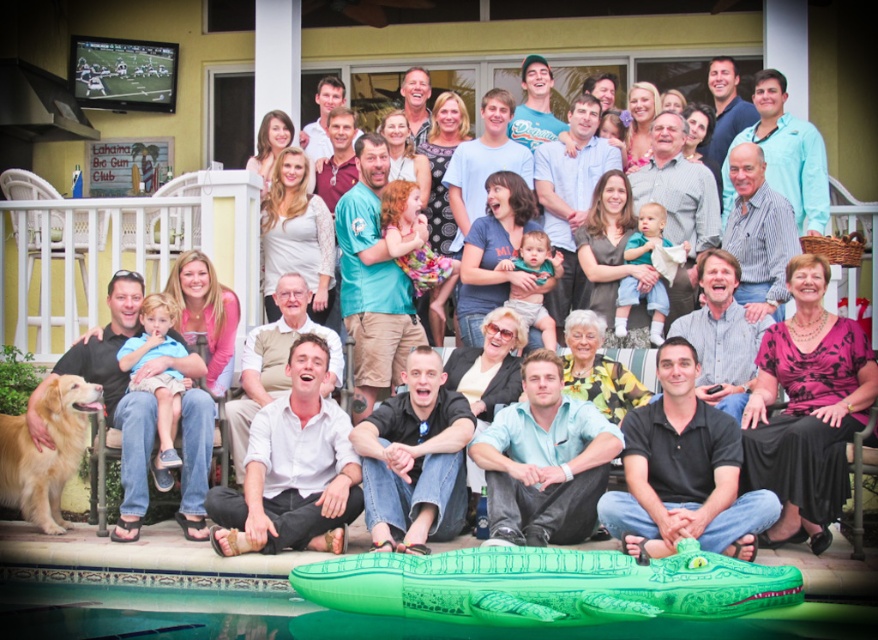
You are organizing a small boat race for children in the group photo. The green inflatable boat at lower center and the golden matte dog at lower left are the only available items. Which item is more suitable as a boat for the children to sit on?

The green inflatable boat at lower center is more suitable as a boat for the children to sit on because it has a larger size compared to the golden matte dog at lower left.

You are standing at the camera position and want to reach a point that is 80.96 feet away. Is the point at coordinates point (473, 598) within your target distance?

The distance of point (473, 598) from camera is 80.96 feet, so yes, the point at coordinates point (473, 598) is exactly at your target distance of 80.96 feet.

You are a photographer standing at the camera position. You want to take a closeup shot of the green inflatable boat at lower center. The camera you are using has a maximum zoom range of 20 meters. Can you zoom in enough to capture the boat clearly?

The green inflatable boat at lower center is 24.10 meters away from the camera. Since the camera can only zoom up to 20 meters, it cannot capture the boat clearly at this distance.